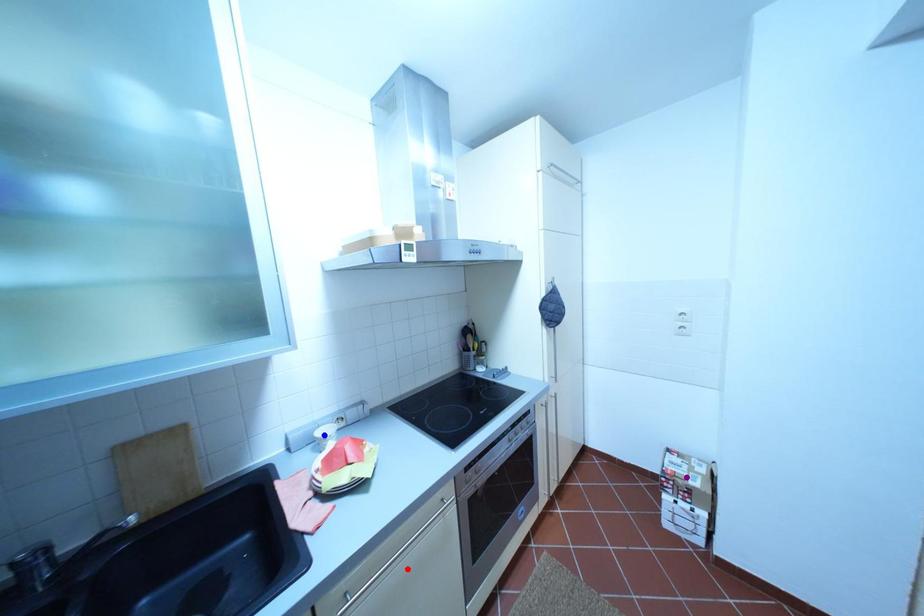
Order these from nearest to farthest:
red point | purple point | blue point

red point, blue point, purple point